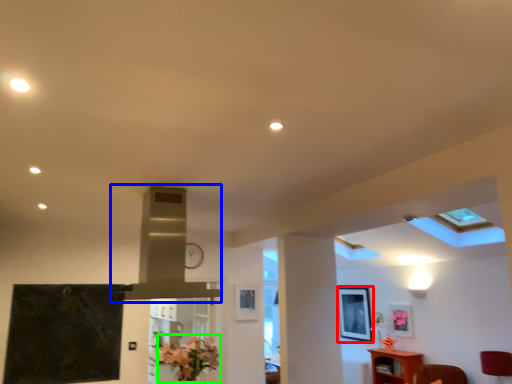
Question: Based on their relative distances, which object is nearer to picture frame (highlighted by a red box)? Choose from exhaust hood (highlighted by a blue box) and flower (highlighted by a green box).

Choices:
 (A) exhaust hood
 (B) flower

Answer: (B)